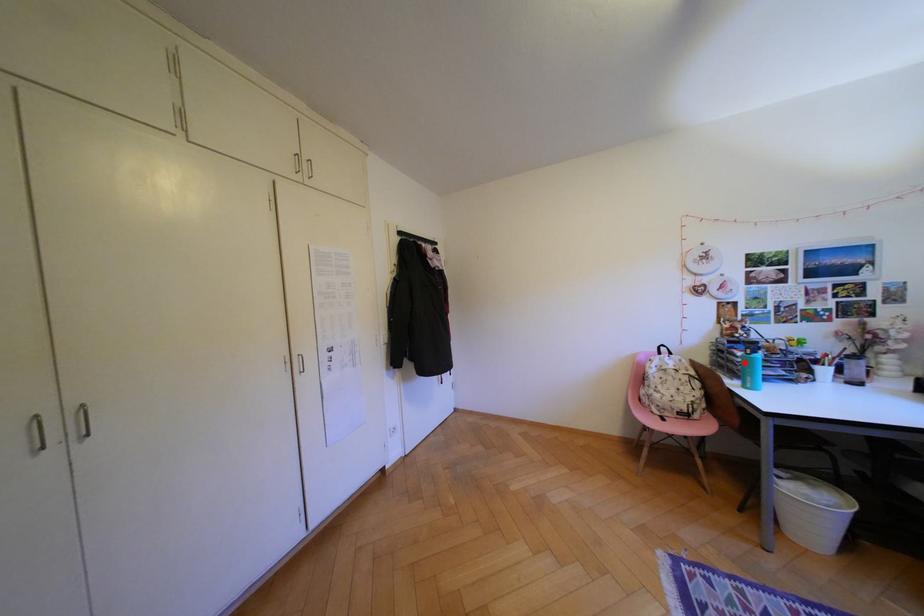
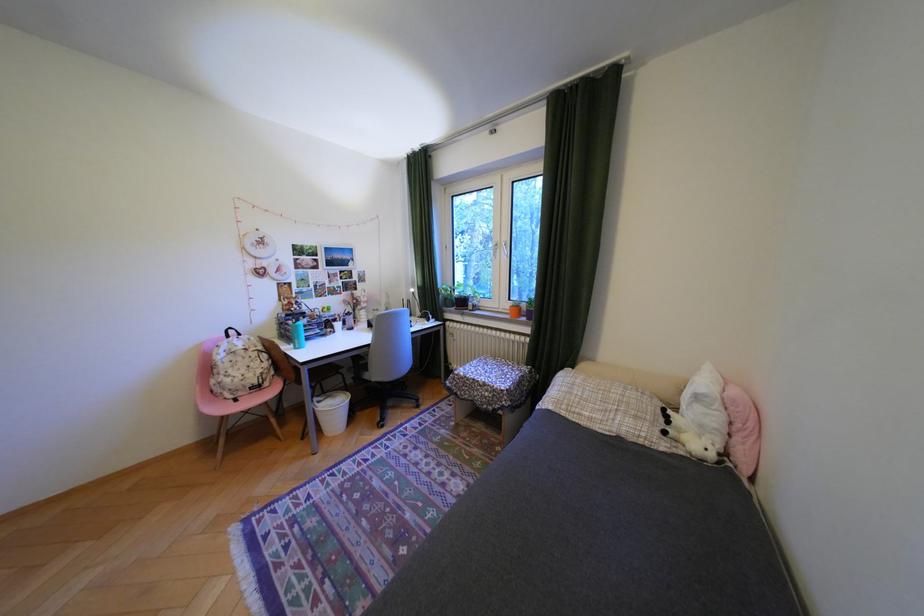
The point at the highlighted location is marked in the first image. Where is the corresponding point in the second image?

(300, 331)